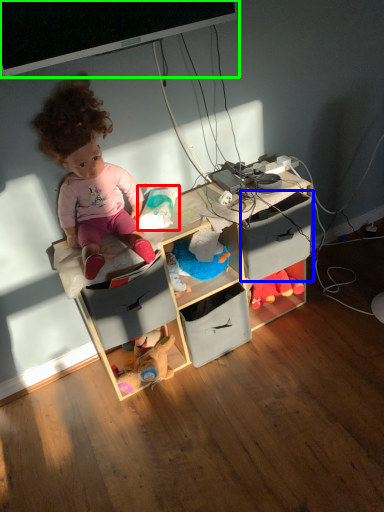
Question: Estimate the real-world distances between objects in this image. Which object is farther from toy (highlighted by a red box), drawer (highlighted by a blue box) or computer monitor (highlighted by a green box)?

Choices:
 (A) drawer
 (B) computer monitor

Answer: (B)